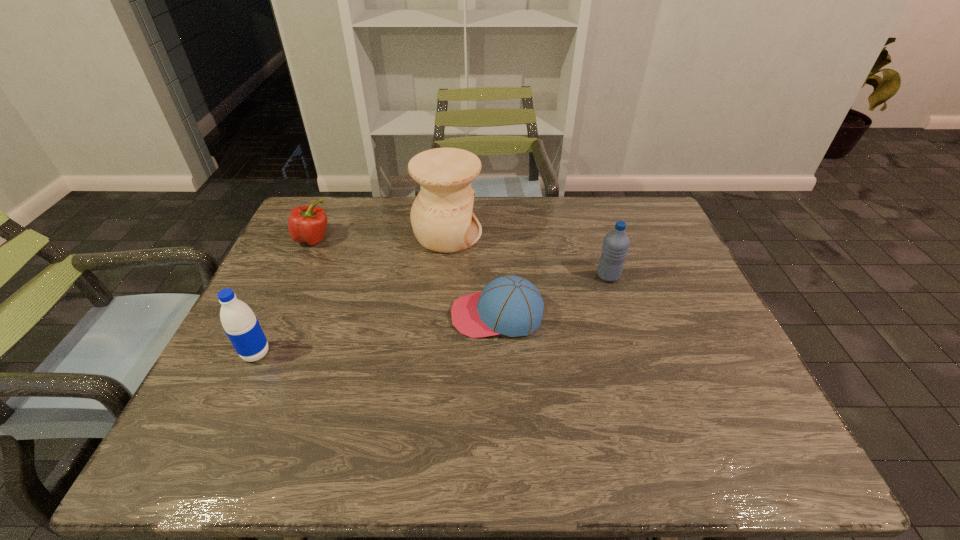
In order to click on free space at the left edge in this screenshot , I will do `click(262, 402)`.

The height and width of the screenshot is (540, 960). In the image, there is a desktop. Identify the location of vacant space at the right edge. (682, 261).

Where is `free space at the far left corner of the desktop`? The height and width of the screenshot is (540, 960). free space at the far left corner of the desktop is located at coordinates (326, 237).

At what (x,y) coordinates should I click in order to perform the action: click on vacant space at the near left corner of the desktop. Please return your answer as a coordinate pair (x, y). Looking at the image, I should click on (204, 458).

Locate an element on the screen. blank space at the far right corner is located at coordinates (627, 225).

Locate an element on the screen. The height and width of the screenshot is (540, 960). free spot between the baseball cap and the pottery is located at coordinates (472, 274).

In order to click on vacant area between the bell pepper and the pottery in this screenshot , I will do `click(380, 237)`.

The image size is (960, 540). I want to click on free point between the bell pepper and the tallest object, so click(380, 237).

This screenshot has width=960, height=540. I want to click on vacant area that lies between the pottery and the farther water bottle, so click(528, 255).

In order to click on vacant space in between the nearer water bottle and the bell pepper in this screenshot , I will do `click(285, 296)`.